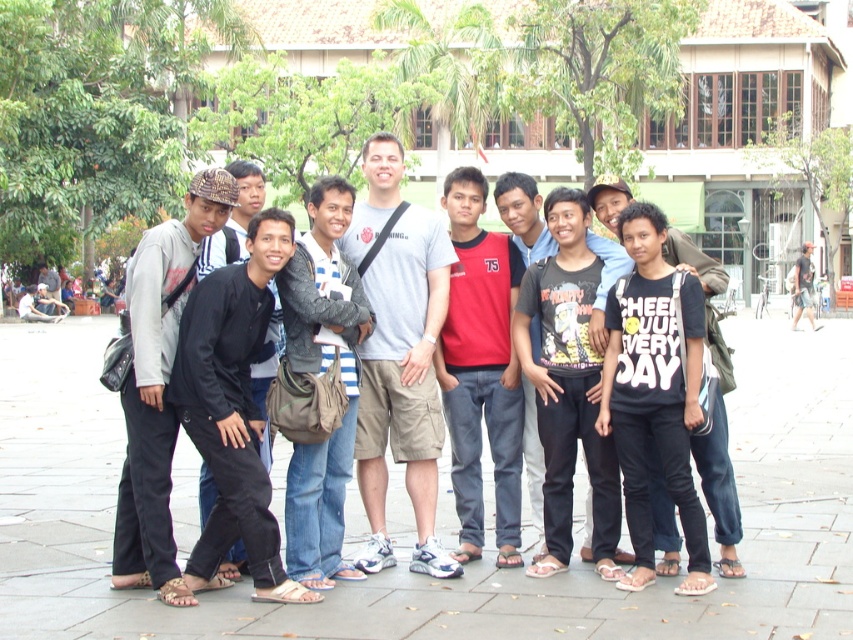
Question: Is black matte jacket at center above dark gray sweater at center?

Choices:
 (A) yes
 (B) no

Answer: (B)

Question: Considering the real-world distances, which object is farthest from the black matte jacket at left?

Choices:
 (A) dark gray sweater at center
 (B) gray cotton t-shirt at center

Answer: (B)

Question: Is gray cotton t-shirt at center bigger than black matte pants at center?

Choices:
 (A) no
 (B) yes

Answer: (A)

Question: From the image, what is the correct spatial relationship of black cotton shirt at center in relation to dark gray fabric jacket at left?

Choices:
 (A) right
 (B) left

Answer: (A)

Question: Which object is the closest to the gray cotton t-shirt at center?

Choices:
 (A) black cotton shirt at center
 (B) black matte jacket at center

Answer: (B)

Question: Which object appears farthest from the camera in this image?

Choices:
 (A) gray cotton t-shirt at center
 (B) black matte jacket at left

Answer: (A)